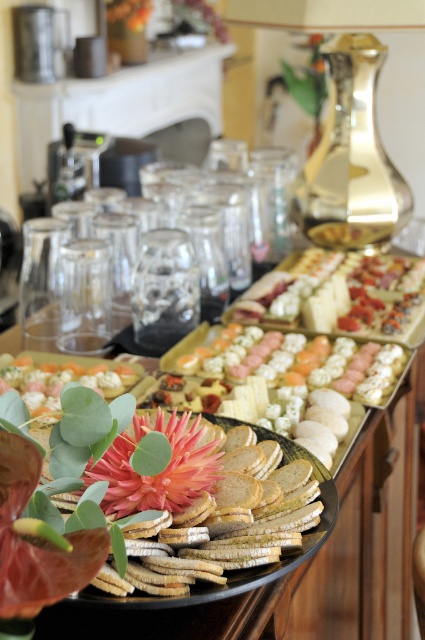
Which is below, sliced cheese at center or white crumbly cheese at center?

Positioned lower is white crumbly cheese at center.

Is point (374, 272) more distant than point (255, 368)?

Yes, point (374, 272) is farther from viewer.

This screenshot has height=640, width=425. Find the location of `sliced cheese at center`. sliced cheese at center is located at coordinates (346, 292).

Who is positioned more to the left, white crumbly cheese at center or white cracker at center?

Positioned to the left is white cracker at center.

Is white crumbly cheese at center to the right of white cracker at center from the viewer's perspective?

Correct, you'll find white crumbly cheese at center to the right of white cracker at center.

This screenshot has width=425, height=640. In order to click on white crumbly cheese at center in this screenshot , I will do `click(300, 362)`.

The width and height of the screenshot is (425, 640). In order to click on white crumbly cheese at center in this screenshot , I will do click(x=300, y=362).

Describe the element at coordinates (346, 292) in the screenshot. The image size is (425, 640). I see `sliced cheese at center` at that location.

Can you confirm if sliced cheese at center is taller than white cracker at center?

Yes, sliced cheese at center is taller than white cracker at center.

Is point (340, 307) closer to camera compared to point (107, 397)?

No, (340, 307) is further to viewer.

Identify the location of sliced cheese at center. (346, 292).